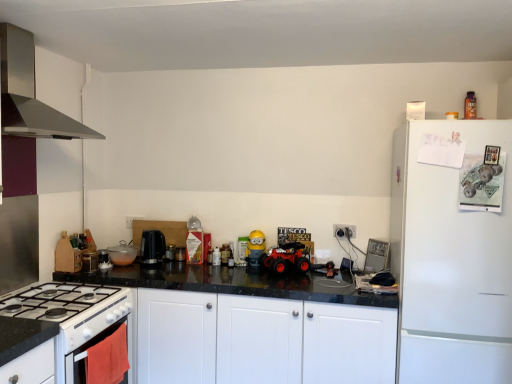
Question: Is translucent glass bowl at center, which is counted as the second kitchen appliance, starting from the front, further to camera compared to black plastic kettle at center, which is counted as the second appliance, starting from the right?

Choices:
 (A) yes
 (B) no

Answer: (B)

Question: Does translucent glass bowl at center, the 2th kitchen appliance positioned from the top, contain black plastic kettle at center, which is counted as the second appliance, starting from the right?

Choices:
 (A) no
 (B) yes

Answer: (A)

Question: Considering the relative sizes of translucent glass bowl at center, which is counted as the second kitchen appliance, starting from the front, and black plastic kettle at center, which is counted as the second appliance, starting from the right, in the image provided, is translucent glass bowl at center, which is counted as the second kitchen appliance, starting from the front, shorter than black plastic kettle at center, which is counted as the second appliance, starting from the right,?

Choices:
 (A) yes
 (B) no

Answer: (B)

Question: Does translucent glass bowl at center, arranged as the first kitchen appliance when viewed from the back, have a larger size compared to black plastic kettle at center, which is counted as the second appliance, starting from the right?

Choices:
 (A) no
 (B) yes

Answer: (B)

Question: Is translucent glass bowl at center, the first kitchen appliance when ordered from bottom to top, closer to the viewer compared to black plastic kettle at center, placed as the first appliance when sorted from left to right?

Choices:
 (A) no
 (B) yes

Answer: (B)

Question: Is translucent glass bowl at center, the first kitchen appliance when ordered from bottom to top, not inside black plastic kettle at center, placed as the first appliance when sorted from left to right?

Choices:
 (A) yes
 (B) no

Answer: (A)

Question: Can you confirm if stainless steel range hood at upper left, which is the 1th kitchen appliance in top-to-bottom order, is positioned to the left of black plastic coffee machine at center?

Choices:
 (A) yes
 (B) no

Answer: (A)

Question: Is stainless steel range hood at upper left, the 1th kitchen appliance from the front, thinner than black plastic coffee machine at center?

Choices:
 (A) yes
 (B) no

Answer: (B)

Question: Is stainless steel range hood at upper left, which is the 1th kitchen appliance in top-to-bottom order, positioned with its back to black plastic coffee machine at center?

Choices:
 (A) no
 (B) yes

Answer: (A)

Question: Does stainless steel range hood at upper left, marked as the 2th kitchen appliance in a bottom-to-top arrangement, have a greater width compared to black plastic coffee machine at center?

Choices:
 (A) yes
 (B) no

Answer: (A)

Question: Considering the relative positions of stainless steel range hood at upper left, the second kitchen appliance from the back, and black plastic coffee machine at center in the image provided, is stainless steel range hood at upper left, the second kitchen appliance from the back, in front of black plastic coffee machine at center?

Choices:
 (A) no
 (B) yes

Answer: (B)

Question: Would you say stainless steel range hood at upper left, which is the 1th kitchen appliance in top-to-bottom order, is outside black plastic coffee machine at center?

Choices:
 (A) yes
 (B) no

Answer: (A)

Question: Can you confirm if white matte refrigerator at right is shorter than black plastic coffee machine at center?

Choices:
 (A) yes
 (B) no

Answer: (B)